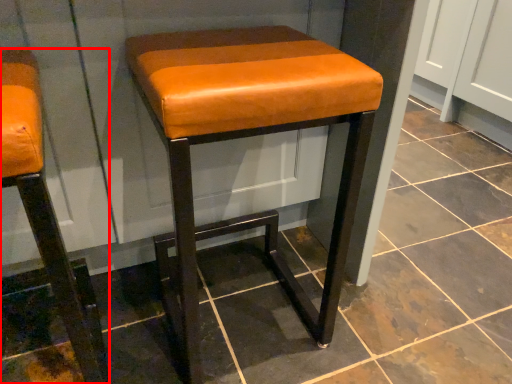
Question: In this image, where is stool (annotated by the red box) located relative to stool?

Choices:
 (A) left
 (B) right

Answer: (A)